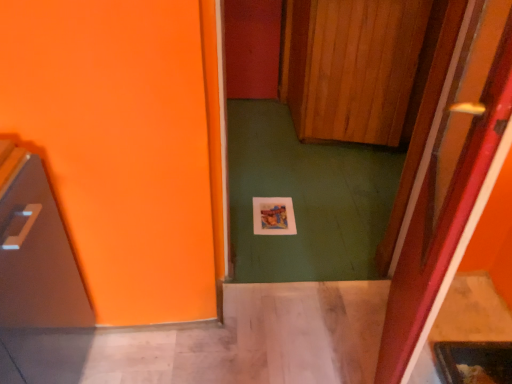
Identify the location of wooden at center, placed as the second door when sorted from front to back. (354, 68).

This screenshot has width=512, height=384. I want to click on shiny metallic microwave at left, so click(x=35, y=250).

From a real-world perspective, is shiny metallic microwave at left on wooden at center, which is counted as the 1th door, starting from the front?

No, from a real-world perspective, shiny metallic microwave at left is not over wooden at center, which is counted as the 1th door, starting from the front

Would you say shiny metallic microwave at left contains wooden at center, the second door when ordered from back to front?

No, wooden at center, the second door when ordered from back to front, is not inside shiny metallic microwave at left.

Does shiny metallic microwave at left lie in front of wooden at center, which is counted as the 1th door, starting from the front?

That is False.

Considering the relative sizes of shiny metallic microwave at left and wooden at center, acting as the 1th door starting from the bottom, in the image provided, is shiny metallic microwave at left shorter than wooden at center, acting as the 1th door starting from the bottom,?

Yes.

The height and width of the screenshot is (384, 512). I want to click on door on the right side of wooden at center, the second door when ordered from back to front, so click(x=354, y=68).

How much distance is there between wooden at center, which is counted as the 1th door, starting from the front, and wooden at center, placed as the second door when sorted from front to back?

wooden at center, which is counted as the 1th door, starting from the front, and wooden at center, placed as the second door when sorted from front to back, are 4.36 feet apart.

From a real-world perspective, is wooden at center, the second door when ordered from back to front, on wooden at center, placed as the second door when sorted from front to back?

Correct, in the physical world, wooden at center, the second door when ordered from back to front, is higher than wooden at center, placed as the second door when sorted from front to back.

Between wooden at center, acting as the 1th door starting from the bottom, and wooden at center, the 1th door from the back, which one has larger width?

wooden at center, the 1th door from the back.

Can you tell me how much wooden at center, the 2th door positioned from the bottom, and wooden at center, the second door in the top-to-bottom sequence, differ in facing direction?

The angle between the facing direction of wooden at center, the 2th door positioned from the bottom, and the facing direction of wooden at center, the second door in the top-to-bottom sequence, is 114 degrees.

Is wooden at center, the 2th door positioned from the bottom, positioned in front of wooden at center, the second door when ordered from back to front?

No.

Based on the photo, from the image's perspective, who appears lower, wooden at center, the 1th door from the back, or wooden at center, which is counted as the 1th door, starting from the front?

From the image's view, wooden at center, which is counted as the 1th door, starting from the front, is below.

Considering the relative sizes of wooden at center, placed as the second door when sorted from front to back, and wooden at center, the second door when ordered from back to front, in the image provided, is wooden at center, placed as the second door when sorted from front to back, shorter than wooden at center, the second door when ordered from back to front,?

Correct, wooden at center, placed as the second door when sorted from front to back, is not as tall as wooden at center, the second door when ordered from back to front.

Does wooden at center, the second door in the top-to-bottom sequence, come in front of shiny metallic microwave at left?

Yes, wooden at center, the second door in the top-to-bottom sequence, is closer to the camera.

How much distance is there between wooden at center, acting as the 1th door starting from the bottom, and shiny metallic microwave at left?

37.77 inches.

Is wooden at center, the second door when ordered from back to front, smaller than shiny metallic microwave at left?

Yes.

Image resolution: width=512 pixels, height=384 pixels. There is a shiny metallic microwave at left. What are the coordinates of `the 2nd door above it (from a real-world perspective)` in the screenshot? It's located at (450, 188).

Which of these two, shiny metallic microwave at left or wooden at center, the first door viewed from the top, stands taller?

wooden at center, the first door viewed from the top.

Is there a large distance between shiny metallic microwave at left and wooden at center, the first door viewed from the top?

shiny metallic microwave at left is positioned a significant distance from wooden at center, the first door viewed from the top.

From a real-world perspective, between shiny metallic microwave at left and wooden at center, placed as the second door when sorted from front to back, who is vertically lower?

shiny metallic microwave at left is physically lower.

Considering the points (22, 212) and (410, 22), which point is in front, point (22, 212) or point (410, 22)?

The point (22, 212) is closer to the camera.

Is wooden at center, the 2th door positioned from the bottom, not close to shiny metallic microwave at left?

Yes, wooden at center, the 2th door positioned from the bottom, is far from shiny metallic microwave at left.

Is wooden at center, the 1th door from the back, not inside shiny metallic microwave at left?

wooden at center, the 1th door from the back, lies outside shiny metallic microwave at left's area.

From a real-world perspective, is wooden at center, the first door viewed from the top, above or below shiny metallic microwave at left?

From a real-world perspective, wooden at center, the first door viewed from the top, is physically above shiny metallic microwave at left.

Which is more to the right, wooden at center, the 1th door from the back, or shiny metallic microwave at left?

From the viewer's perspective, wooden at center, the 1th door from the back, appears more on the right side.

From the image's perspective, which door is the 1st one above the shiny metallic microwave at left? Please provide its 2D coordinates.

[(450, 188)]

Where is `door on the right of the wooden at center, the second door when ordered from back to front`? Image resolution: width=512 pixels, height=384 pixels. door on the right of the wooden at center, the second door when ordered from back to front is located at coordinates (354, 68).

Based on their spatial positions, is wooden at center, placed as the second door when sorted from front to back, or shiny metallic microwave at left closer to wooden at center, the second door in the top-to-bottom sequence?

The object closer to wooden at center, the second door in the top-to-bottom sequence, is shiny metallic microwave at left.

Which object lies further to the anchor point wooden at center, which is counted as the 1th door, starting from the front, shiny metallic microwave at left or wooden at center, the 1th door from the back?

Among the two, wooden at center, the 1th door from the back, is located further to wooden at center, which is counted as the 1th door, starting from the front.

Which object lies further to the anchor point wooden at center, the 2th door positioned from the bottom, shiny metallic microwave at left or wooden at center, acting as the 1th door starting from the bottom?

shiny metallic microwave at left lies further to wooden at center, the 2th door positioned from the bottom, than the other object.

Which object lies further to the anchor point shiny metallic microwave at left, wooden at center, the second door when ordered from back to front, or wooden at center, the 1th door from the back?

wooden at center, the 1th door from the back, lies further to shiny metallic microwave at left than the other object.

Looking at the image, which one is located closer to shiny metallic microwave at left, wooden at center, placed as the second door when sorted from front to back, or wooden at center, the second door when ordered from back to front?

The object closer to shiny metallic microwave at left is wooden at center, the second door when ordered from back to front.

Which object lies further to the anchor point wooden at center, the 2th door positioned from the bottom, wooden at center, which is counted as the 1th door, starting from the front, or shiny metallic microwave at left?

The object further to wooden at center, the 2th door positioned from the bottom, is shiny metallic microwave at left.

Locate an element on the screen. Image resolution: width=512 pixels, height=384 pixels. appliance between wooden at center, which is counted as the 1th door, starting from the front, and wooden at center, the 1th door from the back, from front to back is located at coordinates (35, 250).